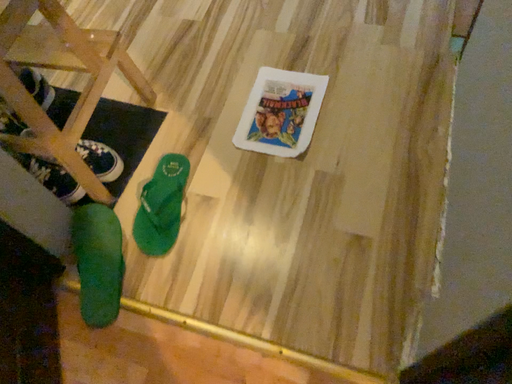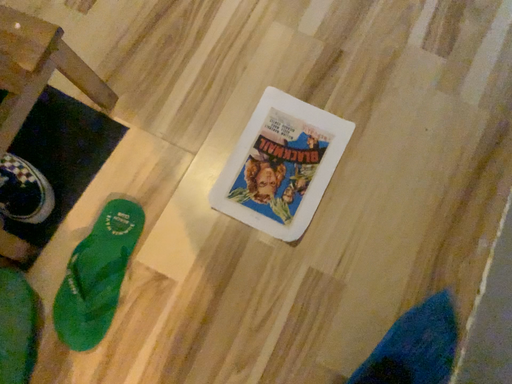
Question: Which way did the camera rotate in the video?

Choices:
 (A) rotated downward
 (B) rotated upward

Answer: (A)